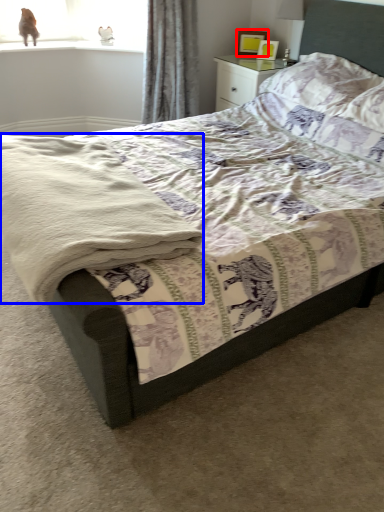
Question: Which object appears farthest to the camera in this image, picture frame (highlighted by a red box) or material (highlighted by a blue box)?

Choices:
 (A) picture frame
 (B) material

Answer: (A)